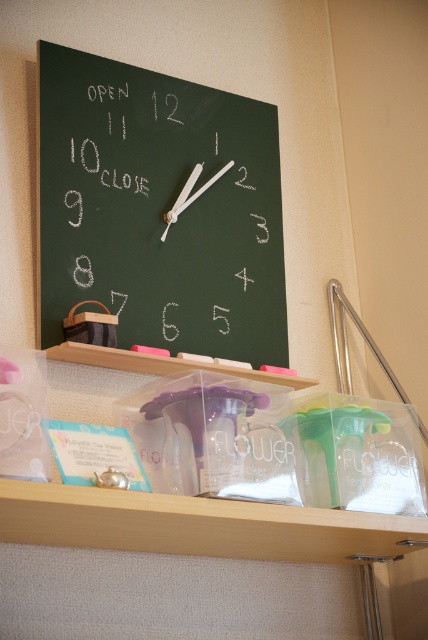
Question: Which point is closer to the camera?

Choices:
 (A) chalkboard at upper center
 (B) clear plastic shelf at lower center

Answer: (B)

Question: In this image, where is chalkboard at upper center located relative to clear plastic shelf at lower center?

Choices:
 (A) above
 (B) below

Answer: (A)

Question: Among these points, which one is farthest from the camera?

Choices:
 (A) (264, 308)
 (B) (300, 532)

Answer: (A)

Question: Which object appears closest to the camera in this image?

Choices:
 (A) clear plastic shelf at lower center
 (B) chalkboard at upper center

Answer: (A)

Question: Does chalkboard at upper center appear over clear plastic shelf at lower center?

Choices:
 (A) no
 (B) yes

Answer: (B)

Question: Is chalkboard at upper center to the right of clear plastic shelf at lower center from the viewer's perspective?

Choices:
 (A) no
 (B) yes

Answer: (A)